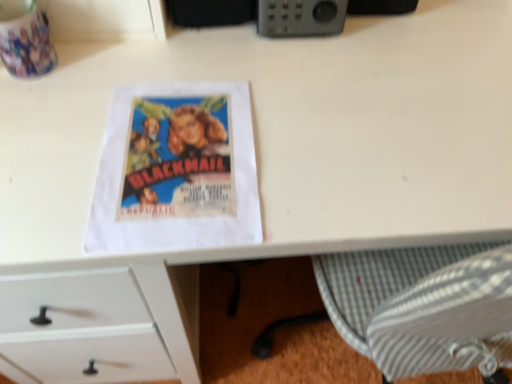
I want to click on matte paper poster at center, so click(176, 171).

This screenshot has width=512, height=384. Describe the element at coordinates (176, 171) in the screenshot. I see `matte paper poster at center` at that location.

This screenshot has width=512, height=384. What do you see at coordinates (301, 17) in the screenshot?
I see `gray plastic radio at upper center` at bounding box center [301, 17].

Locate an element on the screen. Image resolution: width=512 pixels, height=384 pixels. gray plastic radio at upper center is located at coordinates (301, 17).

This screenshot has width=512, height=384. Identify the location of matte paper poster at center. (176, 171).

Can you confirm if gray plastic radio at upper center is positioned to the right of matte paper poster at center?

Indeed, gray plastic radio at upper center is positioned on the right side of matte paper poster at center.

Is gray plastic radio at upper center positioned behind matte paper poster at center?

Yes, gray plastic radio at upper center is behind matte paper poster at center.

Considering the positions of point (291, 34) and point (199, 169), is point (291, 34) closer or farther from the camera than point (199, 169)?

Point (291, 34) appears to be farther away from the viewer than point (199, 169).

Consider the image. From the image's perspective, would you say gray plastic radio at upper center is shown under matte paper poster at center?

No.

From a real-world perspective, who is located lower, gray plastic radio at upper center or matte paper poster at center?

From a 3D spatial view, matte paper poster at center is below.

Considering the sizes of objects gray plastic radio at upper center and matte paper poster at center in the image provided, who is wider, gray plastic radio at upper center or matte paper poster at center?

Wider between the two is matte paper poster at center.

Who is shorter, gray plastic radio at upper center or matte paper poster at center?

matte paper poster at center is shorter.

Is gray plastic radio at upper center smaller than matte paper poster at center?

No.

Could matte paper poster at center be considered to be inside gray plastic radio at upper center?

No, matte paper poster at center is not a part of gray plastic radio at upper center.

From the picture: Are gray plastic radio at upper center and matte paper poster at center beside each other?

gray plastic radio at upper center and matte paper poster at center are not in contact.

Is gray plastic radio at upper center facing away from matte paper poster at center?

gray plastic radio at upper center does not have its back to matte paper poster at center.

How different are the orientations of gray plastic radio at upper center and matte paper poster at center in degrees?

The angular difference between gray plastic radio at upper center and matte paper poster at center is 2.41 degrees.

Measure the distance from gray plastic radio at upper center to matte paper poster at center.

11.98 inches.

Locate an element on the screen. This screenshot has height=384, width=512. paperback book in front of the gray plastic radio at upper center is located at coordinates [176, 171].

Consider the image. Visually, is matte paper poster at center positioned to the left or to the right of gray plastic radio at upper center?

matte paper poster at center is to the left of gray plastic radio at upper center.

Which object is further away from the camera, matte paper poster at center or gray plastic radio at upper center?

gray plastic radio at upper center.

Is point (185, 230) positioned after point (261, 21)?

No, (185, 230) is closer to viewer.

From the image's perspective, which is below, matte paper poster at center or gray plastic radio at upper center?

From the image's view, matte paper poster at center is below.

From a real-world perspective, between matte paper poster at center and gray plastic radio at upper center, who is vertically higher?

In real-world perspective, gray plastic radio at upper center is above.

Looking at their sizes, would you say matte paper poster at center is wider or thinner than gray plastic radio at upper center?

matte paper poster at center is wider than gray plastic radio at upper center.

In terms of height, does matte paper poster at center look taller or shorter compared to gray plastic radio at upper center?

Clearly, matte paper poster at center is shorter compared to gray plastic radio at upper center.

Based on their sizes in the image, would you say matte paper poster at center is bigger or smaller than gray plastic radio at upper center?

matte paper poster at center is smaller than gray plastic radio at upper center.

Is matte paper poster at center outside of gray plastic radio at upper center?

That's correct, matte paper poster at center is outside of gray plastic radio at upper center.

Is there a large distance between matte paper poster at center and gray plastic radio at upper center?

No.

Based on the photo, could you tell me if matte paper poster at center is facing gray plastic radio at upper center?

No, matte paper poster at center is not facing towards gray plastic radio at upper center.

I want to click on paperback book on the left of gray plastic radio at upper center, so click(176, 171).

The height and width of the screenshot is (384, 512). In the image, there is a gray plastic radio at upper center. What are the coordinates of `paperback book below it (from a real-world perspective)` in the screenshot? It's located at (176, 171).

Locate an element on the screen. paperback book on the left of gray plastic radio at upper center is located at coordinates (176, 171).